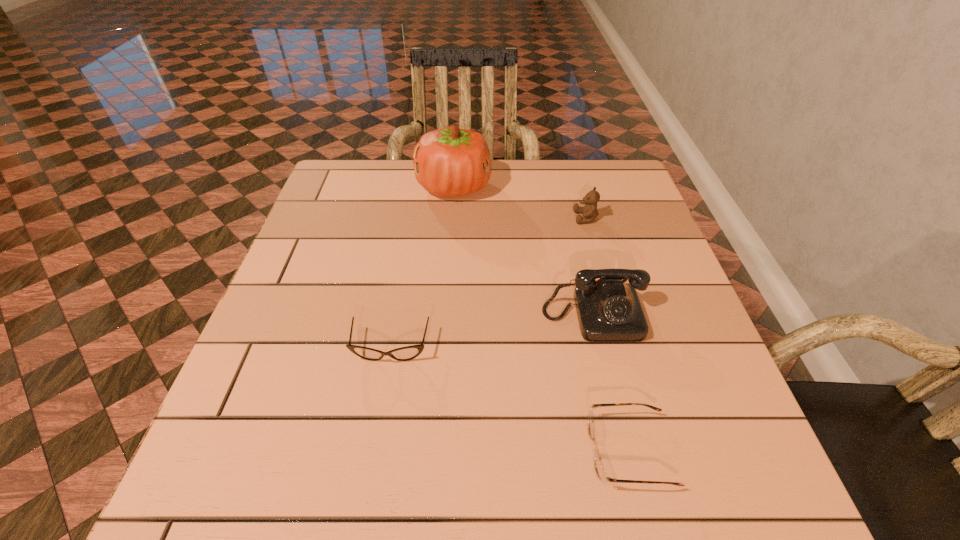
I want to click on the second closest object to the farthest object, so click(608, 310).

At what (x,y) coordinates should I click in order to perform the action: click on vacant space that satisfies the following two spatial constraints: 1. on the front-facing side of the third tallest object; 2. on the front-facing side of the second shortest object. Please return your answer as a coordinate pair (x, y). Looking at the image, I should click on pos(622,347).